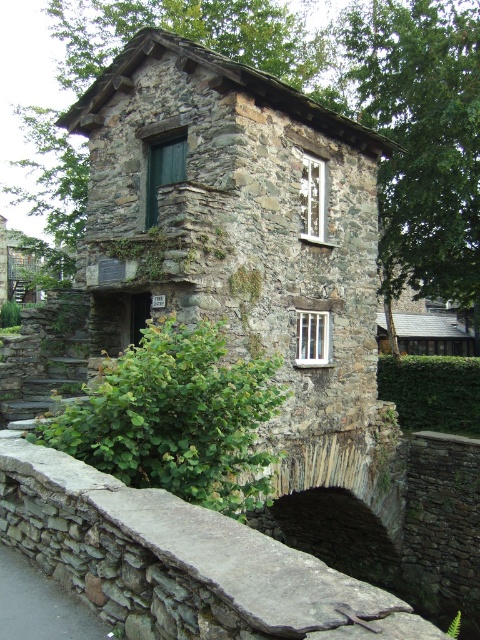
Question: Which of the following is the closest to the observer?

Choices:
 (A) green leafy hedge at lower center
 (B) green leafy hedge at lower left

Answer: (B)

Question: From the image, what is the correct spatial relationship of gray stone ledge at center in relation to green leafy hedge at lower left?

Choices:
 (A) left
 (B) right

Answer: (A)

Question: Which point is closer to the camera?

Choices:
 (A) green leafy hedge at lower left
 (B) green leafy hedge at lower center

Answer: (A)

Question: Estimate the real-world distances between objects in this image. Which object is closer to the green leafy hedge at lower center?

Choices:
 (A) gray stone ledge at center
 (B) green leafy hedge at lower left

Answer: (B)

Question: Is gray stone ledge at center bigger than green leafy hedge at lower left?

Choices:
 (A) yes
 (B) no

Answer: (B)

Question: Where is gray stone ledge at center located in relation to green leafy hedge at lower center in the image?

Choices:
 (A) above
 (B) below

Answer: (A)